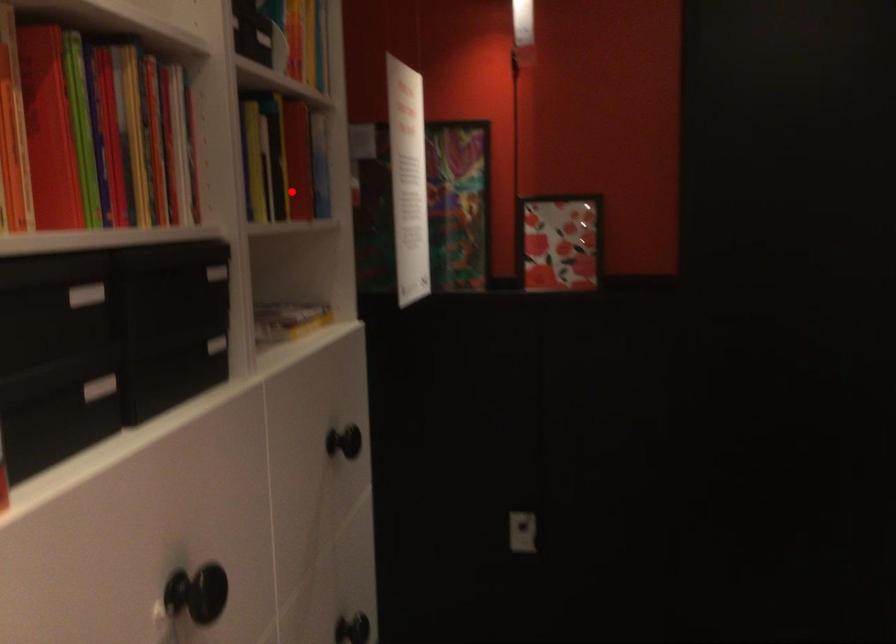
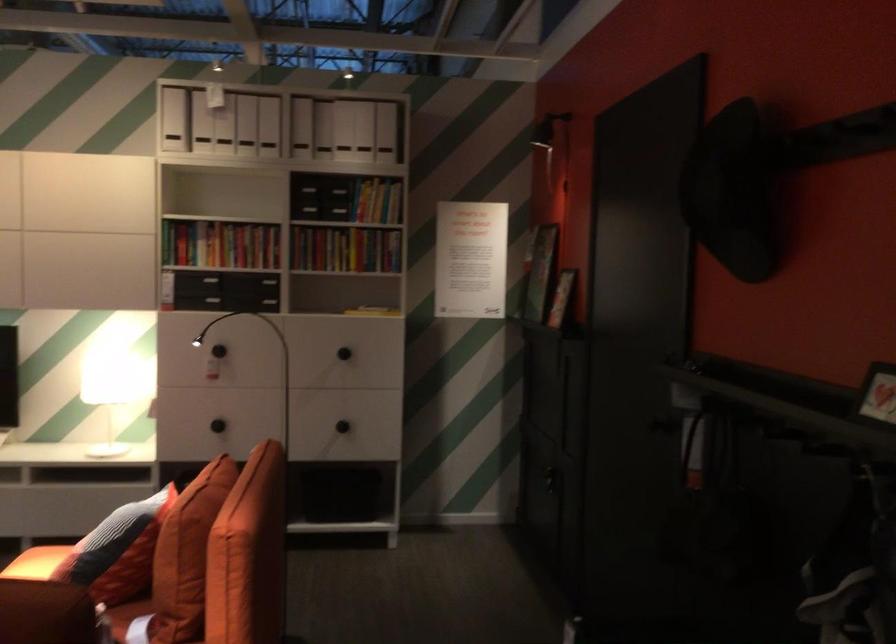
Question: I am providing you with two images of the same scene from different viewpoints. A red point is shown in image1. For the corresponding object point in image2, is it positioned nearer or farther from the camera?

Choices:
 (A) Nearer
 (B) Farther

Answer: (B)